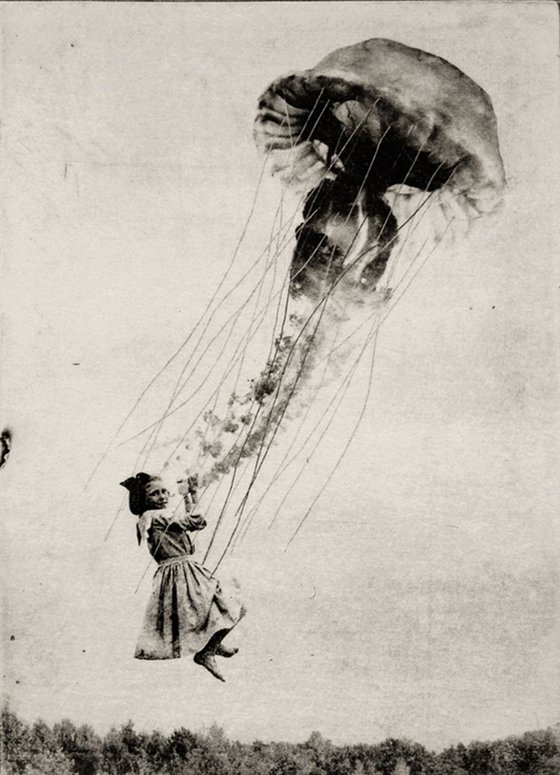
I want to click on canopy, so (x=248, y=758).